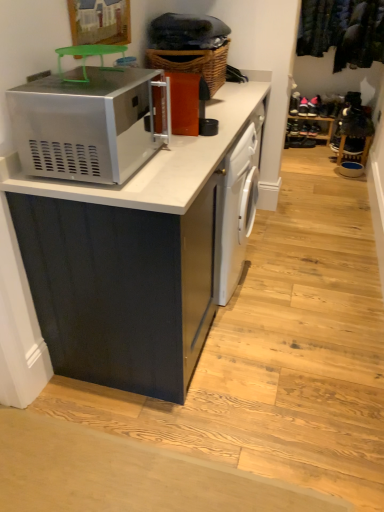
Question: Is point (215, 53) positioned closer to the camera than point (41, 105)?

Choices:
 (A) farther
 (B) closer

Answer: (A)

Question: Relative to satin silver microwave at upper left, is woven brown basket at upper center in front or behind?

Choices:
 (A) front
 (B) behind

Answer: (B)

Question: Considering the real-world distances, which object is farthest from the satin silver microwave at upper left?

Choices:
 (A) dark green fabric at upper right
 (B) woven brown basket at upper center
 (C) matte black cabinet at center
 (D) white glossy dishwasher at center
 (E) wooden shoe rack at center

Answer: (E)

Question: Which is farther from the satin silver microwave at upper left?

Choices:
 (A) dark green fabric at upper right
 (B) matte black cabinet at center
 (C) wooden shoe rack at center
 (D) woven brown basket at upper center
 (E) white glossy dishwasher at center

Answer: (C)